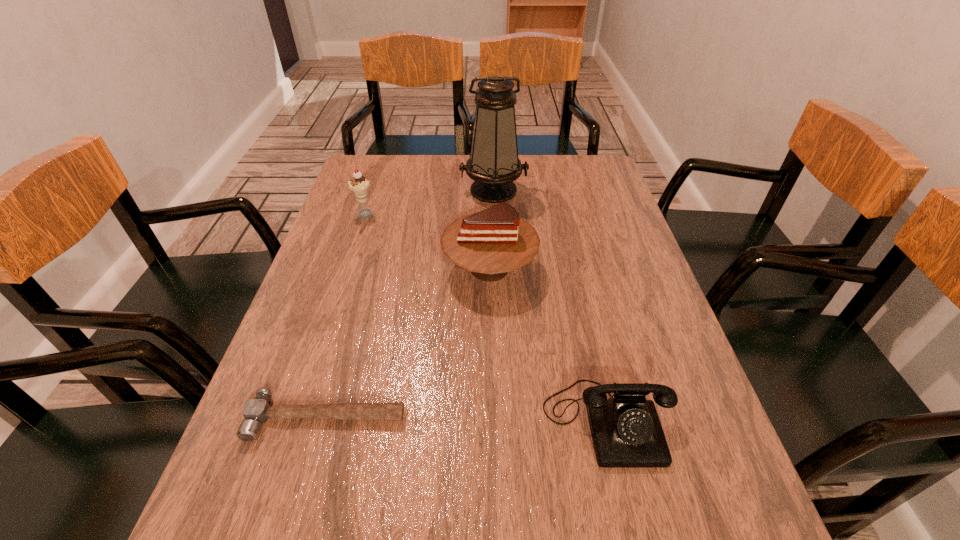
This screenshot has height=540, width=960. In order to click on vacant space located 0.070m on the striking face of the hammer in this screenshot , I will do `click(308, 483)`.

The width and height of the screenshot is (960, 540). I want to click on object that is at the far edge, so click(493, 164).

Identify the location of icecream present at the left edge. Image resolution: width=960 pixels, height=540 pixels. (358, 184).

You are a GUI agent. You are given a task and a screenshot of the screen. Output one action in this format:
    pyautogui.click(x=<x>, y=<y>)
    Task: Click on the hammer at the left edge
    
    Given the screenshot: What is the action you would take?
    pyautogui.click(x=256, y=411)

Locate an element on the screen. This screenshot has width=960, height=540. object that is at the right edge is located at coordinates (626, 431).

In the image, there is a desktop. At what (x,y) coordinates should I click in order to perform the action: click on vacant space at the far edge. Please return your answer as a coordinate pair (x, y). The height and width of the screenshot is (540, 960). Looking at the image, I should click on (533, 191).

This screenshot has height=540, width=960. Find the location of `free spot at the left edge of the desktop`. free spot at the left edge of the desktop is located at coordinates [295, 327].

Find the location of a particular element. The height and width of the screenshot is (540, 960). vacant point at the right edge is located at coordinates (597, 299).

At what (x,y) coordinates should I click in order to perform the action: click on free location at the near left corner. Please return your answer as a coordinate pair (x, y). Looking at the image, I should click on (264, 529).

The image size is (960, 540). In the image, there is a desktop. Find the location of `vacant space at the far right corner`. vacant space at the far right corner is located at coordinates (566, 161).